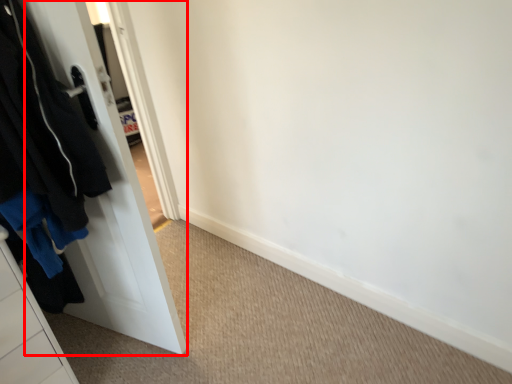
Question: From the image's perspective, where is door (annotated by the red box) located in relation to clothing in the image?

Choices:
 (A) above
 (B) below

Answer: (B)